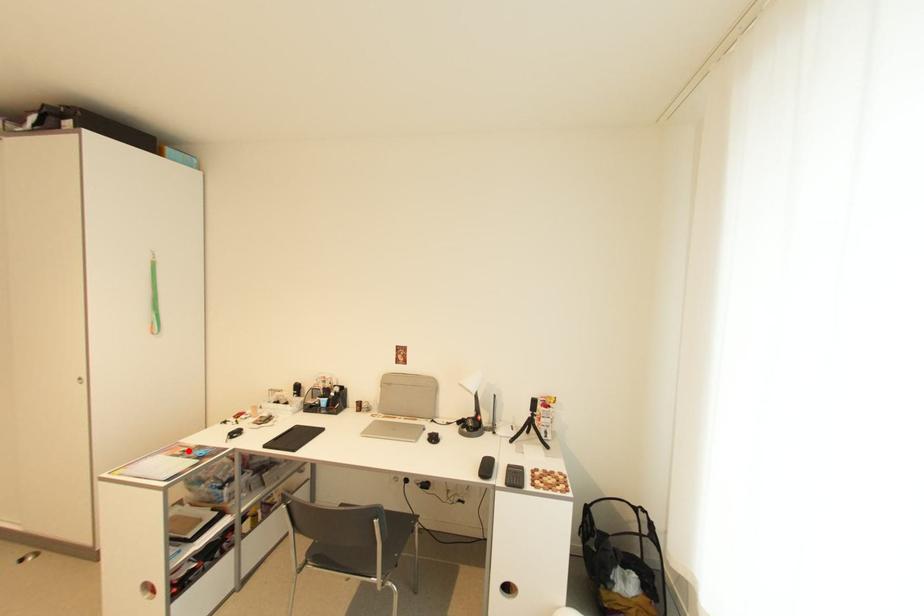
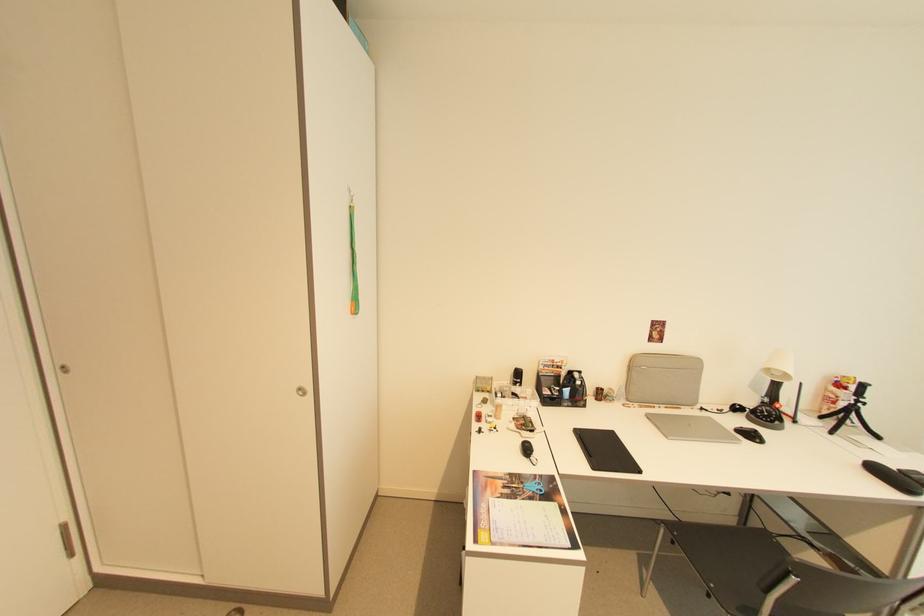
Question: I am providing you with two images of the same scene from different viewpoints. A red point is marked on the first image. Is the red point's position out of view in image 2?

Choices:
 (A) Yes
 (B) No

Answer: (B)